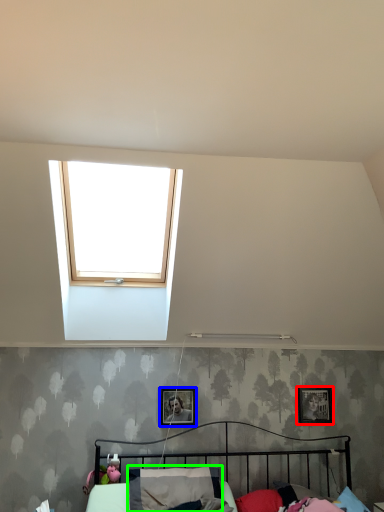
Question: Estimate the real-world distances between objects in this image. Which object is closer to picture frame (highlighted by a red box), picture frame (highlighted by a blue box) or pillow (highlighted by a green box)?

Choices:
 (A) picture frame
 (B) pillow

Answer: (A)